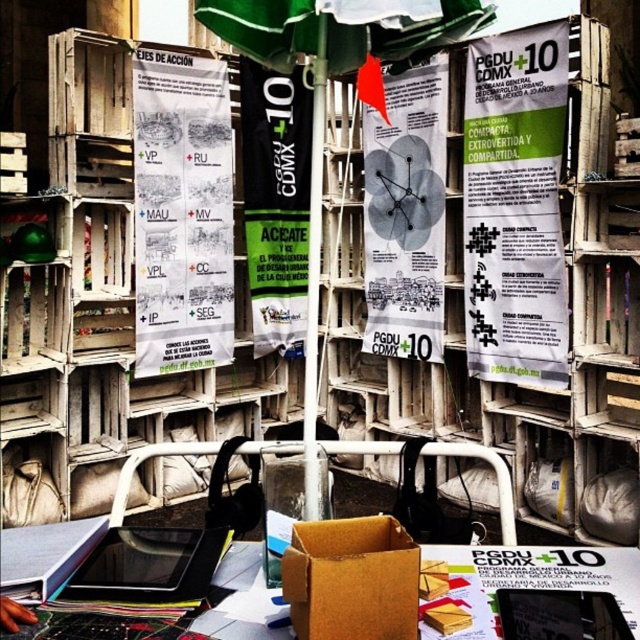
You are at an event booth and need to place a 1.2 meter tall decoration on the table. The table has the green fabric umbrella at center and the cardboard box at lower center. Which object must you move to accommodate the decoration?

The green fabric umbrella at center is taller than the cardboard box at lower center. Since the decoration is 1.2 meters tall, the green fabric umbrella at center must be moved to make space as it is taller and may obstruct the placement of the decoration.